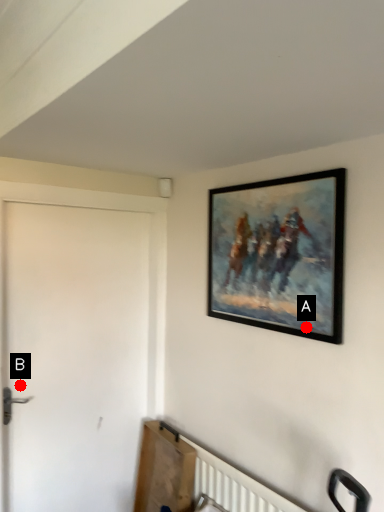
Question: Two points are circled on the image, labeled by A and B beside each circle. Which of the following is the farthest from the observer?

Choices:
 (A) A is further
 (B) B is further

Answer: (B)